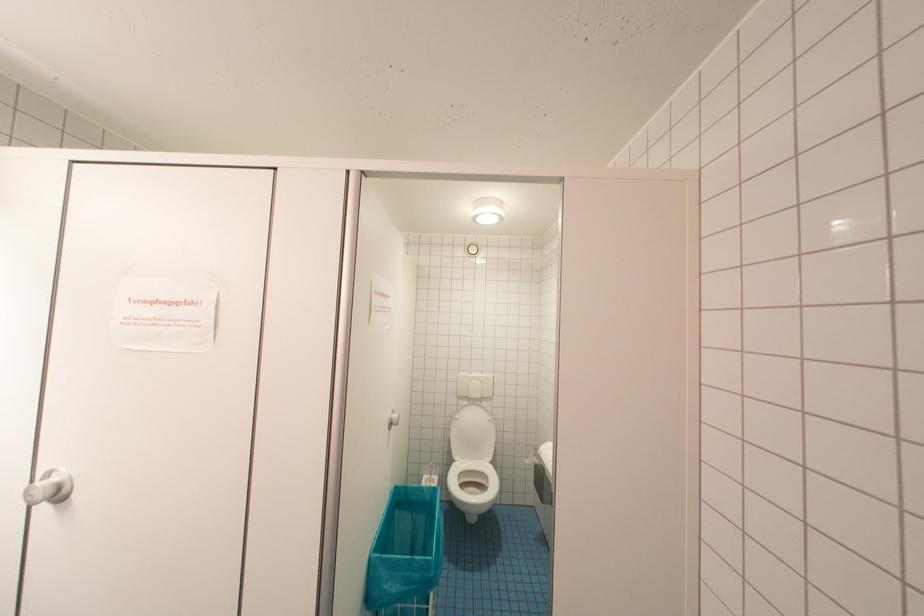
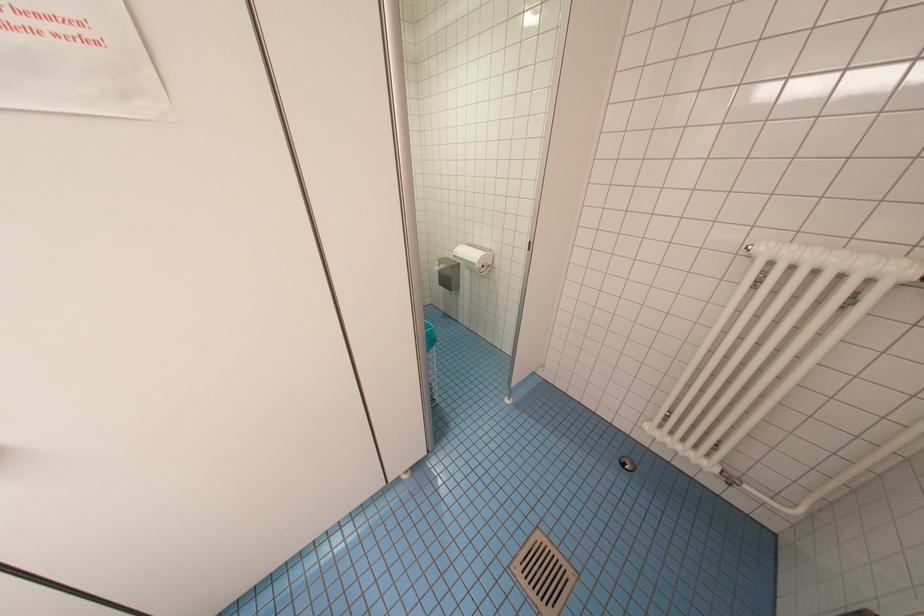
The first image is from the beginning of the video and the second image is from the end. How did the camera likely rotate when shooting the video?

The rotation direction of the camera is right-down.